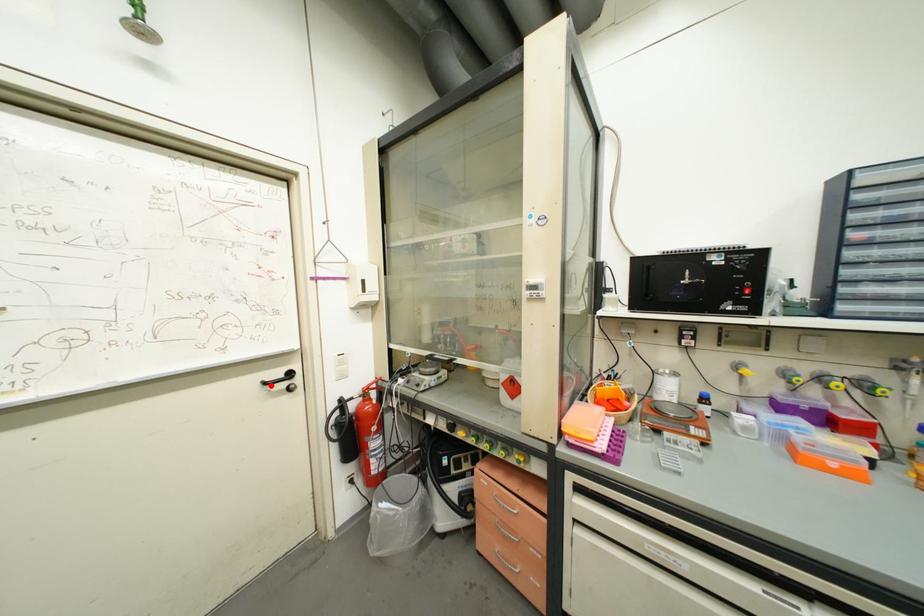
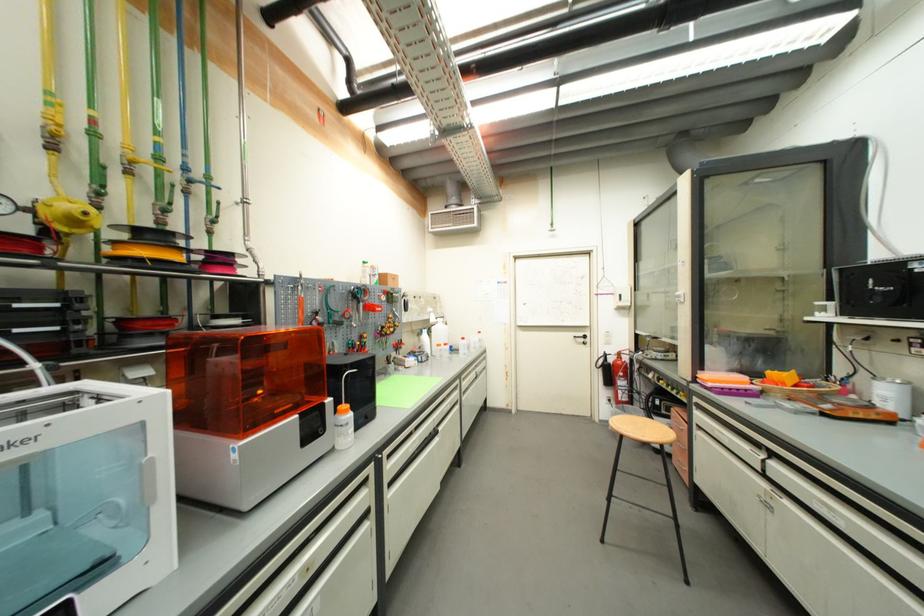
Find the pixel in the second image that matches the highlighted location in the first image.

(580, 339)